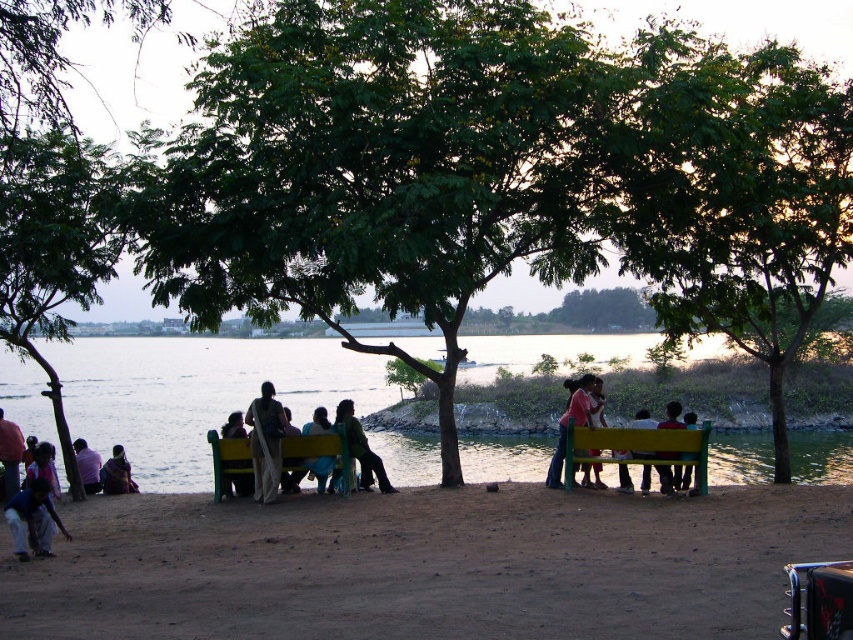
Does green leafy tree at left appear under dark green fabric bench at center?

No, green leafy tree at left is not below dark green fabric bench at center.

Is point (94, 298) less distant than point (238, 424)?

Yes.

At what (x,y) coordinates should I click in order to perform the action: click on green leafy tree at left. Please return your answer as a coordinate pair (x, y). The height and width of the screenshot is (640, 853). Looking at the image, I should click on (51, 248).

Is point (314, 428) closer to viewer compared to point (32, 458)?

Yes, point (314, 428) is in front of point (32, 458).

Which is behind, point (309, 432) or point (53, 460)?

The point (53, 460) is more distant.

At what (x,y) coordinates should I click in order to perform the action: click on blue fabric pants at center. Please return your answer as a coordinate pair (x, y). Looking at the image, I should click on (321, 472).

Does dark green fabric bench at center have a larger size compared to matte green bench at right?

Yes, dark green fabric bench at center is bigger than matte green bench at right.

Is dark green fabric bench at center above matte green bench at right?

Correct, dark green fabric bench at center is located above matte green bench at right.

Describe the element at coordinates (236, 477) in the screenshot. This screenshot has height=640, width=853. I see `dark green fabric bench at center` at that location.

Locate an element on the screen. This screenshot has height=640, width=853. dark green fabric bench at center is located at coordinates (236, 477).